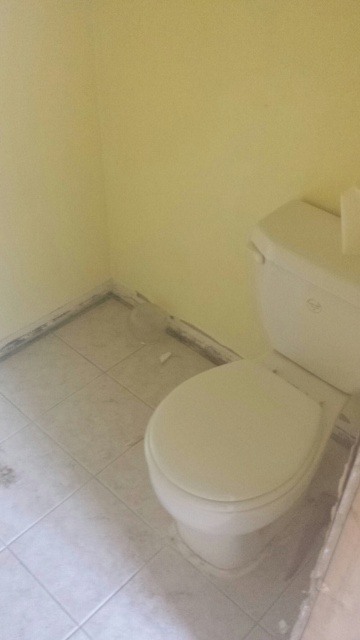
Question: Which of the following is the closest to the observer?

Choices:
 (A) (330, 417)
 (B) (271, 401)

Answer: (B)

Question: Where is white glossy toilet at right located in relation to white matte toilet lid at center in the image?

Choices:
 (A) above
 (B) below

Answer: (A)

Question: Is white glossy toilet at right positioned behind white matte toilet lid at center?

Choices:
 (A) no
 (B) yes

Answer: (B)

Question: Which point is farther from the camera taking this photo?

Choices:
 (A) (191, 445)
 (B) (285, 477)

Answer: (A)

Question: Observing the image, what is the correct spatial positioning of white glossy toilet at right in reference to white matte toilet lid at center?

Choices:
 (A) above
 (B) below

Answer: (A)